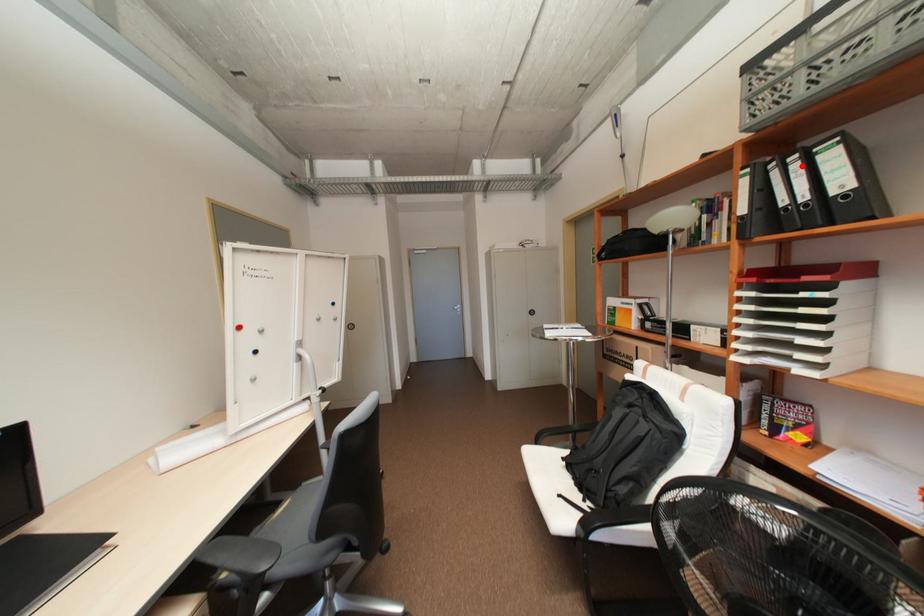
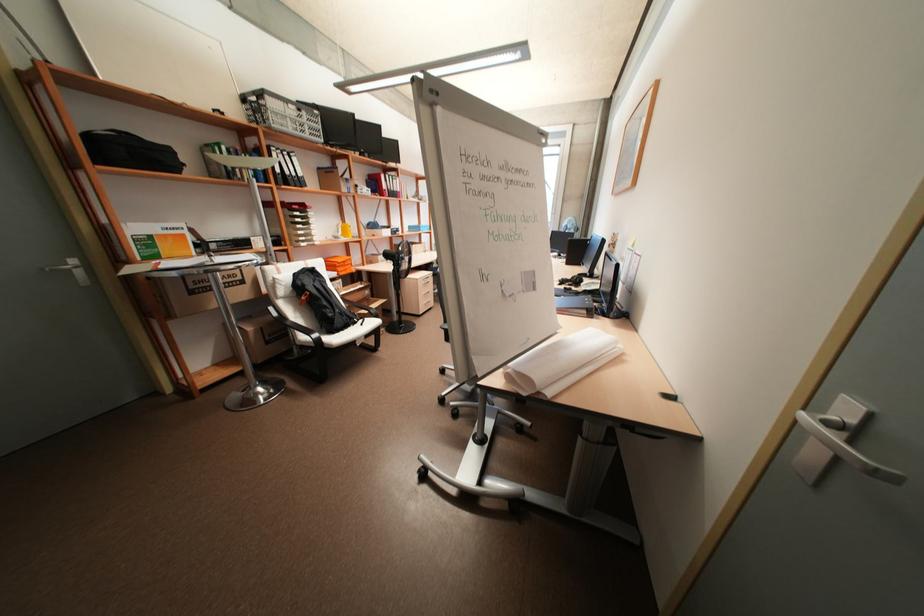
In the second image, find the point that corresponds to the highlighted location in the first image.

(293, 158)